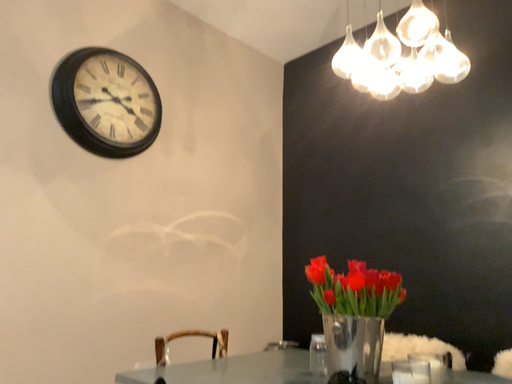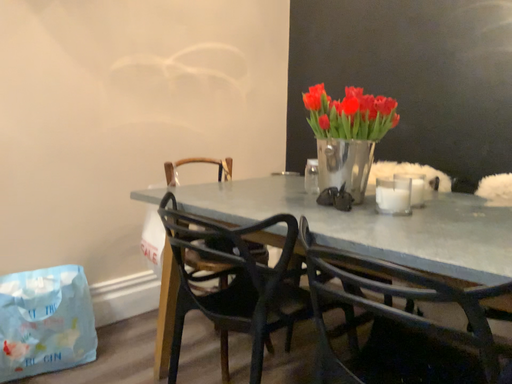
Question: How did the camera likely rotate when shooting the video?

Choices:
 (A) rotated upward
 (B) rotated downward

Answer: (B)